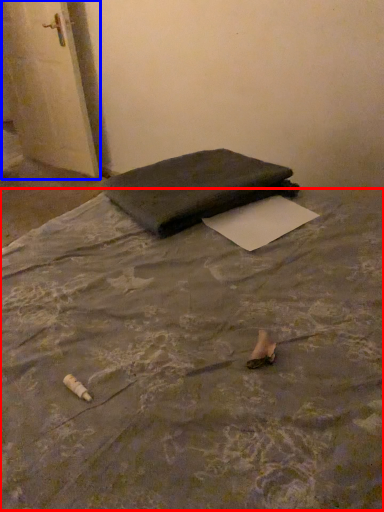
Question: Which point is further to the camera, mattress (highlighted by a red box) or door (highlighted by a blue box)?

Choices:
 (A) mattress
 (B) door

Answer: (B)